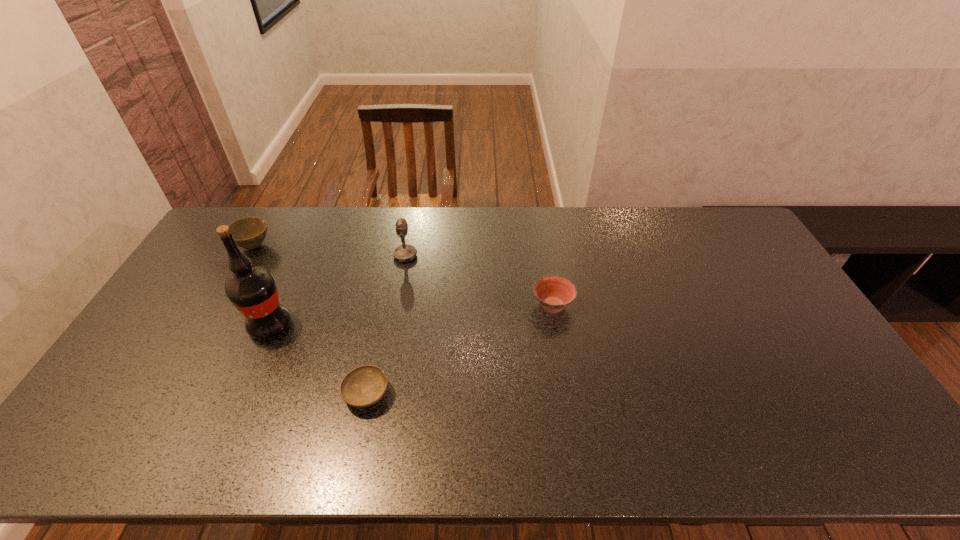
Image resolution: width=960 pixels, height=540 pixels. In the image, there is a desktop. What are the coordinates of `vacant space at the right edge` in the screenshot? It's located at (772, 321).

Find the location of a particular element. This screenshot has height=540, width=960. vacant space at the near left corner of the desktop is located at coordinates (79, 447).

Where is `vacant space at the far right corner of the desktop`? The height and width of the screenshot is (540, 960). vacant space at the far right corner of the desktop is located at coordinates (720, 212).

Image resolution: width=960 pixels, height=540 pixels. I want to click on vacant space that's between the fourth shortest object and the second object from left to right, so click(x=338, y=291).

Where is `vacant space in between the microphone and the fourth object from right to left`? The height and width of the screenshot is (540, 960). vacant space in between the microphone and the fourth object from right to left is located at coordinates (338, 291).

Where is `free area in between the fourth object from right to left and the microphone`? free area in between the fourth object from right to left and the microphone is located at coordinates (338, 291).

Where is `empty location between the third shortest object and the microphone`? This screenshot has height=540, width=960. empty location between the third shortest object and the microphone is located at coordinates (329, 251).

Find the location of `vacant space that is in between the microphone and the second object from left to right`. vacant space that is in between the microphone and the second object from left to right is located at coordinates (338, 291).

At what (x,y) coordinates should I click in order to perform the action: click on empty space that is in between the tallest bowl and the shortest bowl. Please return your answer as a coordinate pair (x, y). The width and height of the screenshot is (960, 540). Looking at the image, I should click on (310, 320).

This screenshot has height=540, width=960. I want to click on vacant point located between the nearest object and the fourth shortest object, so click(386, 325).